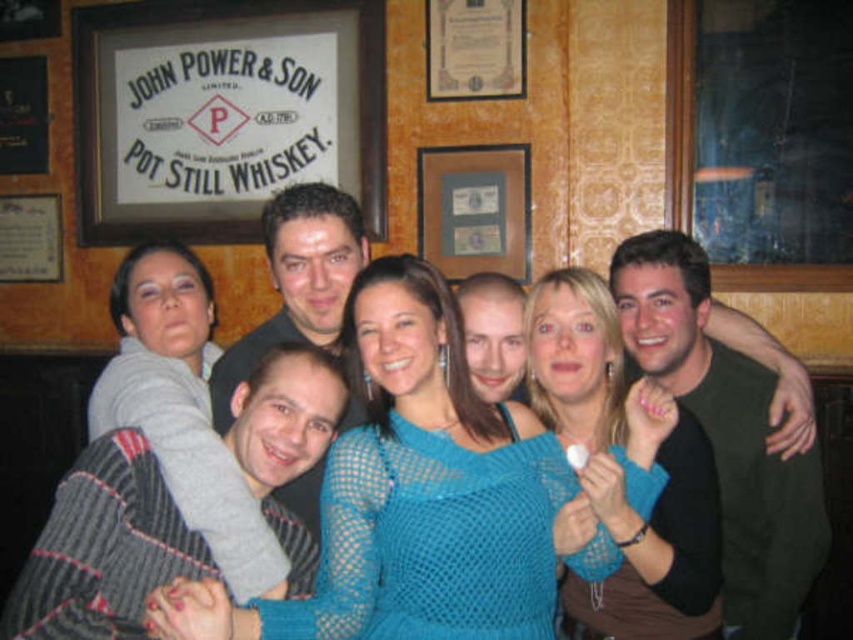
Question: Where is green matte shirt at right located in relation to matte black shirt at center in the image?

Choices:
 (A) above
 (B) below

Answer: (B)

Question: Does knitted teal sweater at center have a smaller size compared to striped sweater at center?

Choices:
 (A) yes
 (B) no

Answer: (B)

Question: Which object appears closest to the camera in this image?

Choices:
 (A) green matte shirt at right
 (B) knitted teal sweater at center

Answer: (B)

Question: Which point appears closest to the camera in this image?

Choices:
 (A) (155, 314)
 (B) (315, 516)
 (C) (224, 600)

Answer: (C)

Question: Which point is closer to the camera?

Choices:
 (A) (196, 93)
 (B) (613, 490)
 (C) (364, 250)

Answer: (B)

Question: Is the position of knitted teal sweater at center more distant than that of striped sweater at center?

Choices:
 (A) yes
 (B) no

Answer: (A)